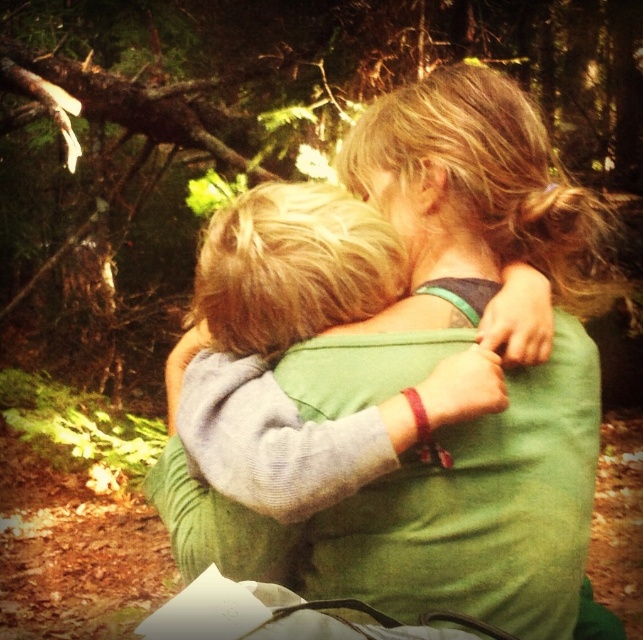
Image resolution: width=643 pixels, height=640 pixels. What do you see at coordinates (248, 134) in the screenshot?
I see `green fabric at center` at bounding box center [248, 134].

Which is below, green fabric at center or green soft sweater at center?

Positioned lower is green soft sweater at center.

Image resolution: width=643 pixels, height=640 pixels. In order to click on green fabric at center in this screenshot , I will do `click(248, 134)`.

Identify the location of green fabric at center. The width and height of the screenshot is (643, 640). (248, 134).

Which is more to the left, green soft sweater at center or light gray fleece sweater at center?

From the viewer's perspective, light gray fleece sweater at center appears more on the left side.

Which is above, green soft sweater at center or light gray fleece sweater at center?

Positioned higher is green soft sweater at center.

Who is more distant from viewer, (534, 416) or (341, 488)?

The point (534, 416) is more distant.

The height and width of the screenshot is (640, 643). In order to click on green soft sweater at center in this screenshot , I will do `click(440, 515)`.

Who is shorter, green fabric at center or light gray fleece sweater at center?

light gray fleece sweater at center is shorter.

Can you confirm if green fabric at center is positioned below light gray fleece sweater at center?

No, green fabric at center is not below light gray fleece sweater at center.

Image resolution: width=643 pixels, height=640 pixels. What do you see at coordinates (248, 134) in the screenshot? I see `green fabric at center` at bounding box center [248, 134].

Image resolution: width=643 pixels, height=640 pixels. What are the coordinates of `green fabric at center` in the screenshot? It's located at (248, 134).